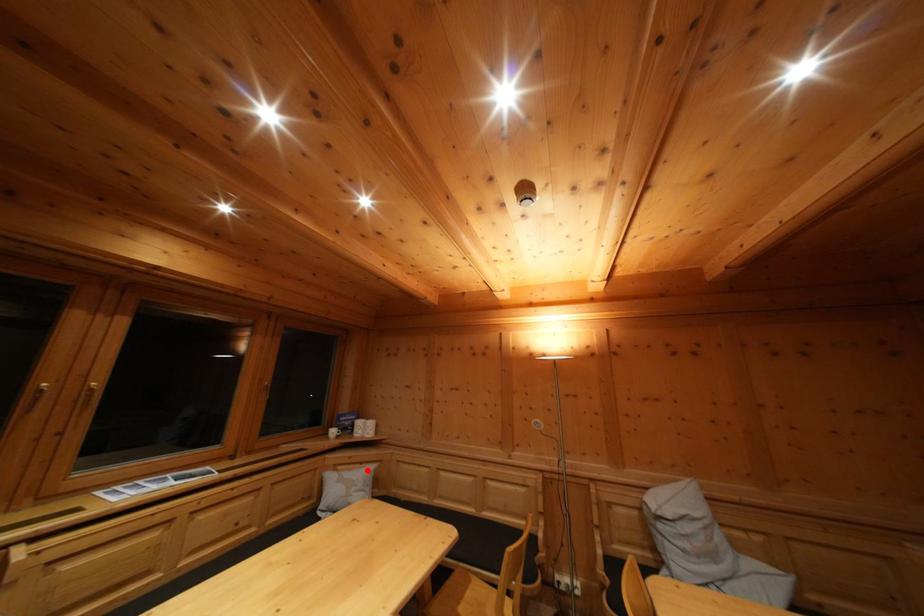
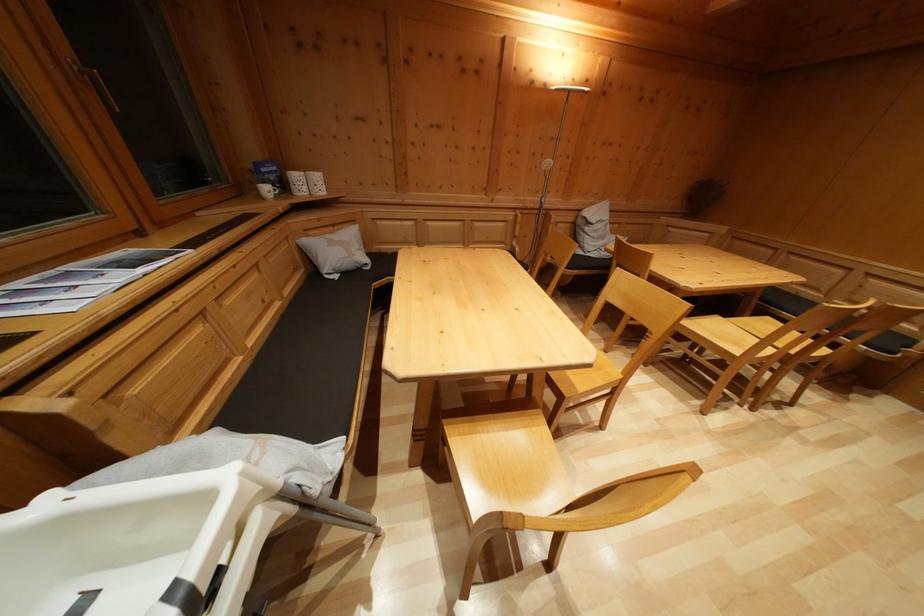
Question: I am providing you with two images of the same scene from different viewpoints. A red point is shown in image1. For the corresponding object point in image2, is it positioned nearer or farther from the camera?

Choices:
 (A) Nearer
 (B) Farther

Answer: (A)